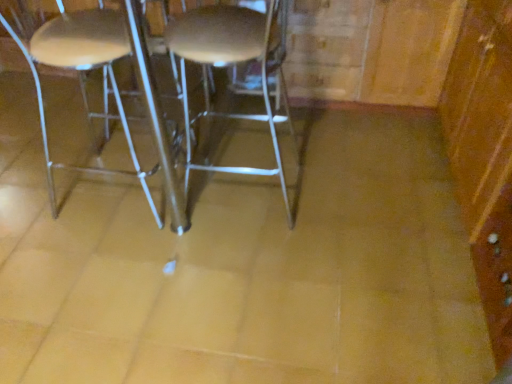
At what (x,y) coordinates should I click in order to perform the action: click on metallic silver stool at center. Please return your answer as a coordinate pair (x, y). Looking at the image, I should click on (234, 65).

Is metallic silver stool at center spatially inside wooden dresser at right, or outside of it?

The correct answer is: outside.

Considering the points (281, 3) and (505, 339), which point is in front, point (281, 3) or point (505, 339)?

The point (505, 339) is more forward.

Is metallic silver stool at center next to wooden dresser at right and touching it?

No, metallic silver stool at center is not with wooden dresser at right.

Are wooden dresser at right and metallic silver stool at left making contact?

No, wooden dresser at right is not touching metallic silver stool at left.

What's the angular difference between wooden dresser at right and metallic silver stool at left's facing directions?

The facing directions of wooden dresser at right and metallic silver stool at left are 178 degrees apart.

Does wooden dresser at right have a larger size compared to metallic silver stool at left?

Yes.

Is wooden dresser at right inside or outside of metallic silver stool at left?

wooden dresser at right is not enclosed by metallic silver stool at left.

Would you say metallic silver stool at center is part of metallic silver stool at left's contents?

No, metallic silver stool at center is not a part of metallic silver stool at left.

Would you consider metallic silver stool at left to be distant from metallic silver stool at center?

metallic silver stool at left is near metallic silver stool at center, not far away.

From a real-world perspective, is metallic silver stool at left beneath metallic silver stool at center?

Indeed, from a real-world perspective, metallic silver stool at left is positioned beneath metallic silver stool at center.

Can you tell me how much metallic silver stool at left and metallic silver stool at center differ in facing direction?

179 degrees.

Can you confirm if metallic silver stool at center is positioned to the left of metallic silver stool at left?

In fact, metallic silver stool at center is to the right of metallic silver stool at left.

In the scene shown: Is metallic silver stool at center taller or shorter than metallic silver stool at left?

In the image, metallic silver stool at center appears to be shorter than metallic silver stool at left.

Is metallic silver stool at left at the back of metallic silver stool at center?

No, metallic silver stool at center is not facing the opposite direction of metallic silver stool at left.

Is point (233, 20) less distant than point (39, 89)?

Yes, it is in front of point (39, 89).

Is the depth of wooden dresser at right less than that of metallic silver stool at center?

Yes, it is.

Is wooden dresser at right next to metallic silver stool at center?

wooden dresser at right is not next to metallic silver stool at center, and they're not touching.

Considering the relative positions of wooden dresser at right and metallic silver stool at center in the image provided, is wooden dresser at right to the left or to the right of metallic silver stool at center?

wooden dresser at right is positioned on metallic silver stool at center's right side.

Looking at the image, does metallic silver stool at left seem bigger or smaller compared to wooden dresser at right?

In the image, metallic silver stool at left appears to be smaller than wooden dresser at right.

Is metallic silver stool at left in front of or behind wooden dresser at right in the image?

metallic silver stool at left is positioned farther from the viewer than wooden dresser at right.

Are metallic silver stool at left and wooden dresser at right beside each other?

No, metallic silver stool at left is not beside wooden dresser at right.

Does metallic silver stool at left turn towards wooden dresser at right?

Yes, metallic silver stool at left is oriented towards wooden dresser at right.

The width and height of the screenshot is (512, 384). In order to click on stool located below the wooden dresser at right (from the image's perspective) in this screenshot , I will do `click(234, 65)`.

Locate an element on the screen. The height and width of the screenshot is (384, 512). dresser in front of the metallic silver stool at left is located at coordinates (484, 154).

From the image, which object appears to be nearer to wooden dresser at right, metallic silver stool at left or metallic silver stool at center?

The object closer to wooden dresser at right is metallic silver stool at center.

Which object lies nearer to the anchor point metallic silver stool at center, wooden dresser at right or metallic silver stool at left?

Among the two, metallic silver stool at left is located nearer to metallic silver stool at center.

When comparing their distances from metallic silver stool at left, does metallic silver stool at center or wooden dresser at right seem closer?

metallic silver stool at center lies closer to metallic silver stool at left than the other object.

Considering their positions, is metallic silver stool at center positioned closer to wooden dresser at right than metallic silver stool at left?

The object closer to wooden dresser at right is metallic silver stool at center.

From the image, which object appears to be nearer to metallic silver stool at left, wooden dresser at right or metallic silver stool at center?

Based on the image, metallic silver stool at center appears to be nearer to metallic silver stool at left.

From the image, which object appears to be nearer to metallic silver stool at center, metallic silver stool at left or wooden dresser at right?

metallic silver stool at left is closer to metallic silver stool at center.

Find the location of a particular element. This screenshot has height=384, width=512. stool located between metallic silver stool at left and wooden dresser at right in the left-right direction is located at coordinates (234, 65).